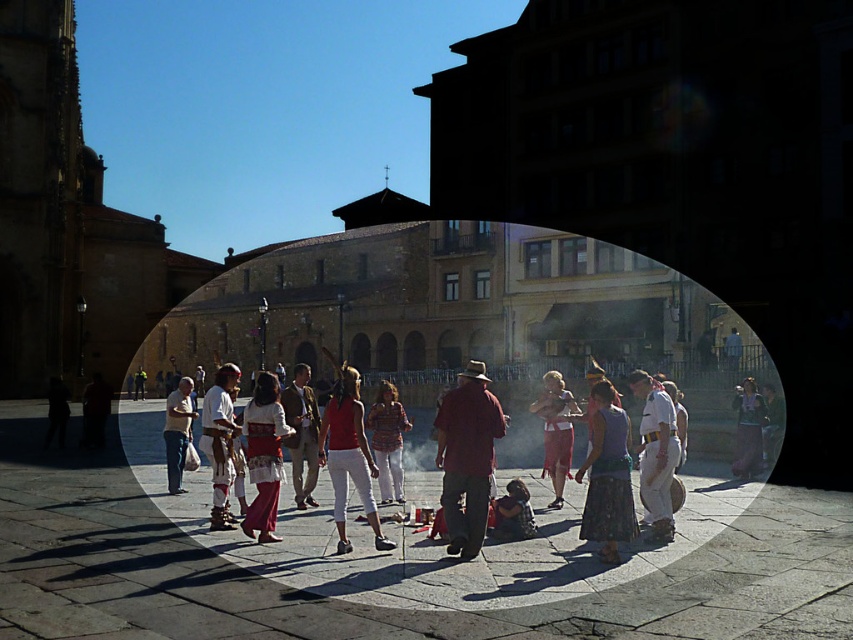
Question: Is embroidered fabric dress at center closer to the viewer compared to denim skirt at center?

Choices:
 (A) yes
 (B) no

Answer: (A)

Question: Which of the following is the farthest from the observer?

Choices:
 (A) (469, 460)
 (B) (357, 406)

Answer: (B)

Question: Observing the image, what is the correct spatial positioning of embroidered fabric dress at center in reference to denim skirt at center?

Choices:
 (A) right
 (B) left

Answer: (B)

Question: Is matte red shirt at center in front of light beige pants at lower left?

Choices:
 (A) no
 (B) yes

Answer: (B)

Question: Estimate the real-world distances between objects in this image. Which object is closer to the brown leather jacket at center?

Choices:
 (A) matte red skirt at center
 (B) matte pink skirt at center
 (C) light beige pants at lower left
 (D) plaid shirt at center

Answer: (D)

Question: Which point is farther to the camera?

Choices:
 (A) matte red shirt at center
 (B) brown leather jacket at center
 (C) matte red blouse at center
 (D) light beige pants at lower left

Answer: (D)